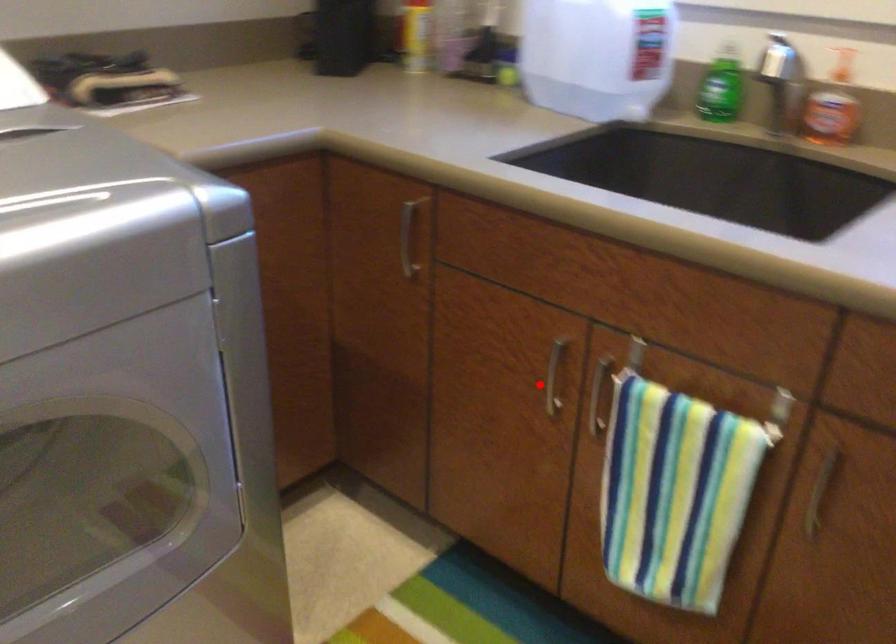
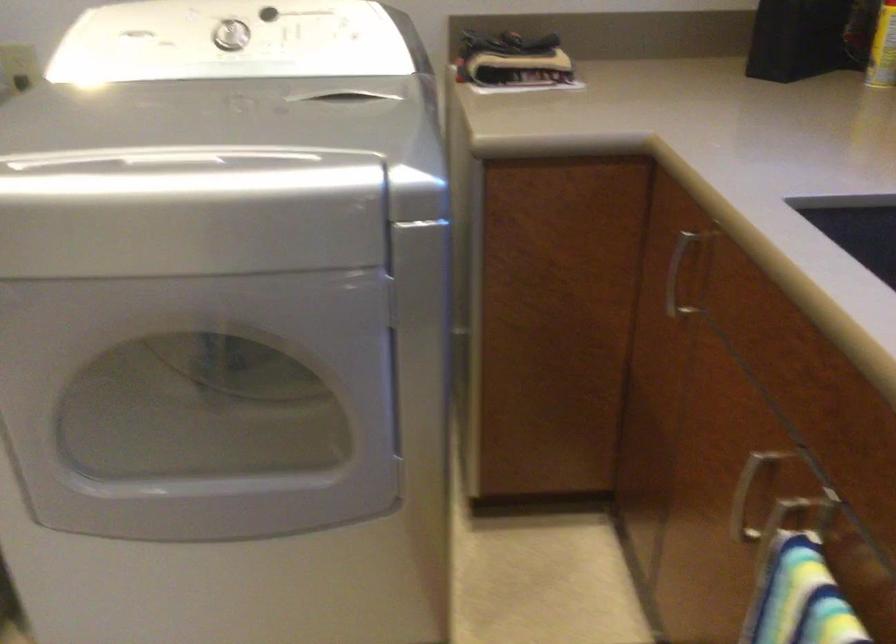
Question: I am providing you with two images of the same scene from different viewpoints. Given a red point in image1, look at the same physical point in image2. Is it:

Choices:
 (A) Closer to the viewpoint
 (B) Farther from the viewpoint

Answer: (A)